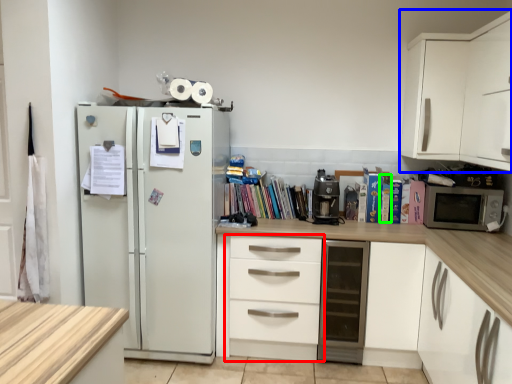
Question: Considering the real-world distances, which object is closest to chest of drawers (highlighted by a red box)? cabinetry (highlighted by a blue box) or paperback book (highlighted by a green box).

Choices:
 (A) cabinetry
 (B) paperback book

Answer: (B)